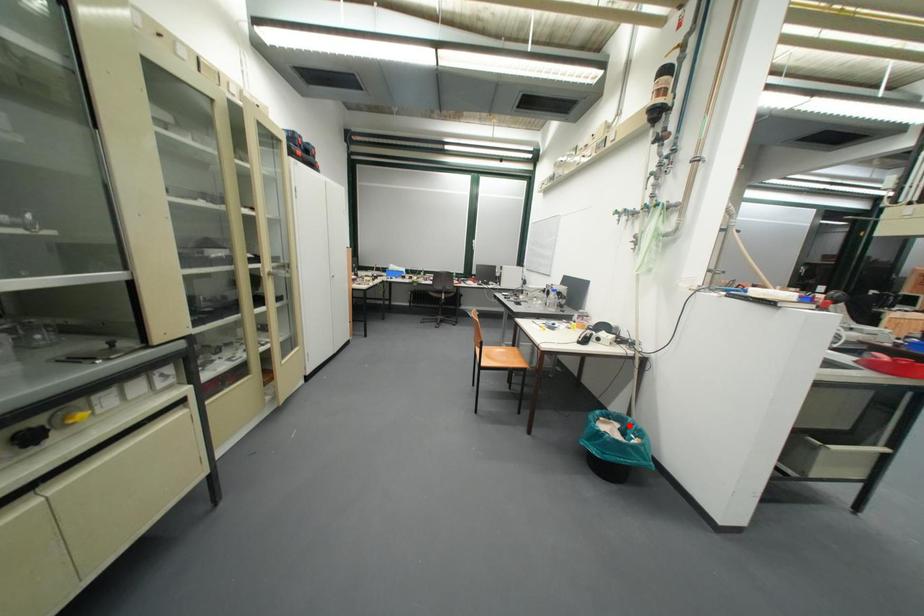
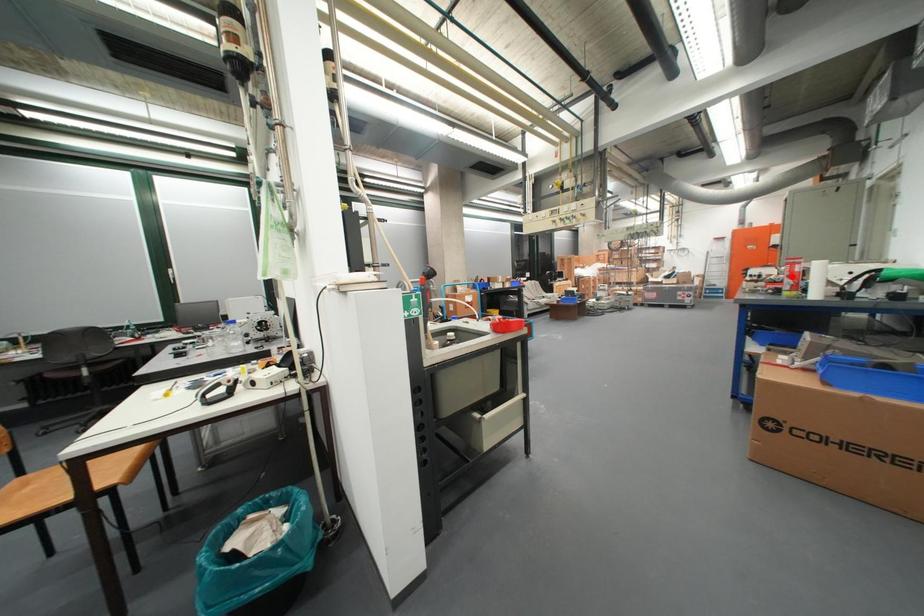
I am providing you with two images of the same scene from different viewpoints. A red point is marked on the first image and another point is marked on the second image. Does the point marked in image1 correspond to the same location as the one in image2?

No